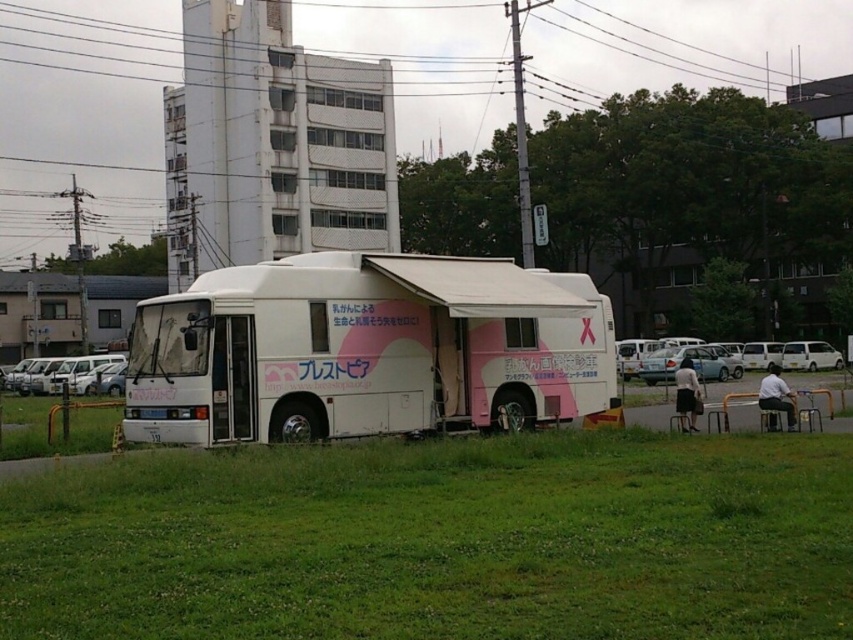
Can you confirm if white matte bus at center is taller than white matte van at left?

Yes, white matte bus at center is taller than white matte van at left.

What do you see at coordinates (366, 349) in the screenshot?
I see `white matte bus at center` at bounding box center [366, 349].

The height and width of the screenshot is (640, 853). In order to click on white matte bus at center in this screenshot , I will do `click(366, 349)`.

Between white matte bus at center and white matte van at center, which one appears on the left side from the viewer's perspective?

From the viewer's perspective, white matte bus at center appears more on the left side.

Is white matte bus at center to the right of white matte van at center from the viewer's perspective?

Incorrect, white matte bus at center is not on the right side of white matte van at center.

Does point (415, 294) come closer to viewer compared to point (666, 353)?

Yes, it is in front of point (666, 353).

Where is `white matte bus at center`? This screenshot has height=640, width=853. white matte bus at center is located at coordinates (366, 349).

Is green grass at lower center smaller than white matte bus at center?

Yes.

Does green grass at lower center lie behind white matte bus at center?

No, it is in front of white matte bus at center.

Between point (346, 497) and point (531, 285), which one is positioned in front?

Point (346, 497) is in front.

The image size is (853, 640). What are the coordinates of `green grass at lower center` in the screenshot? It's located at (439, 540).